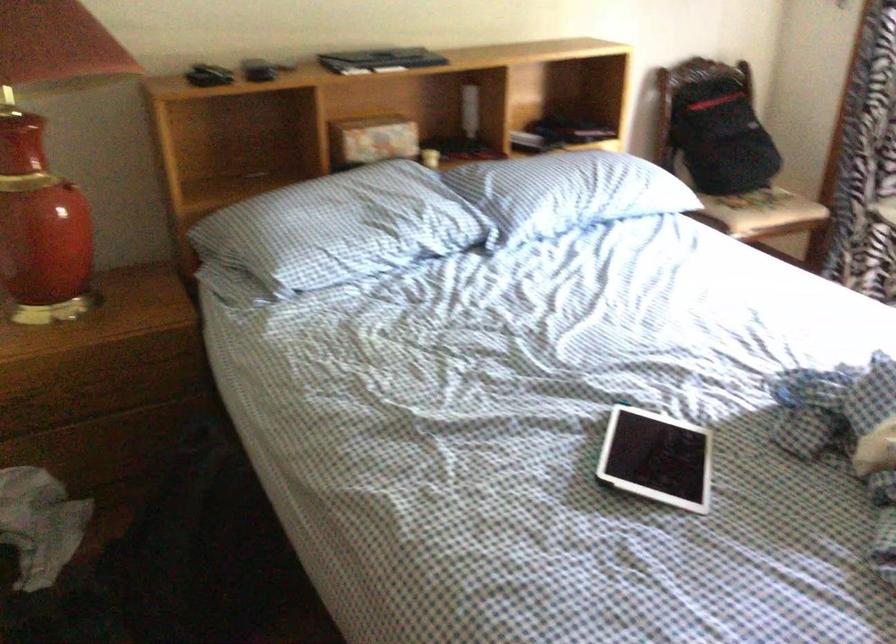
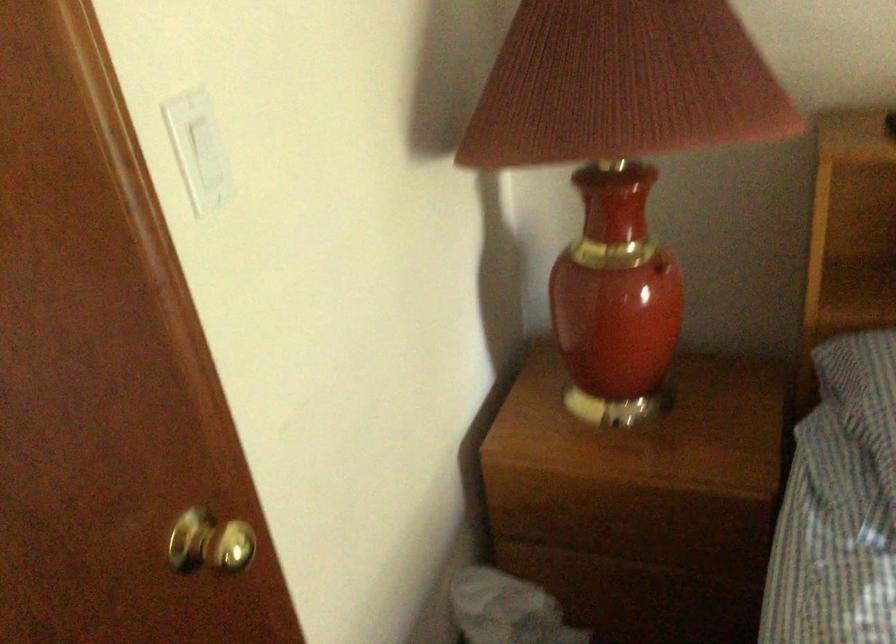
In the second image, find the point that corresponds to pixel 71 185 in the first image.

(661, 267)